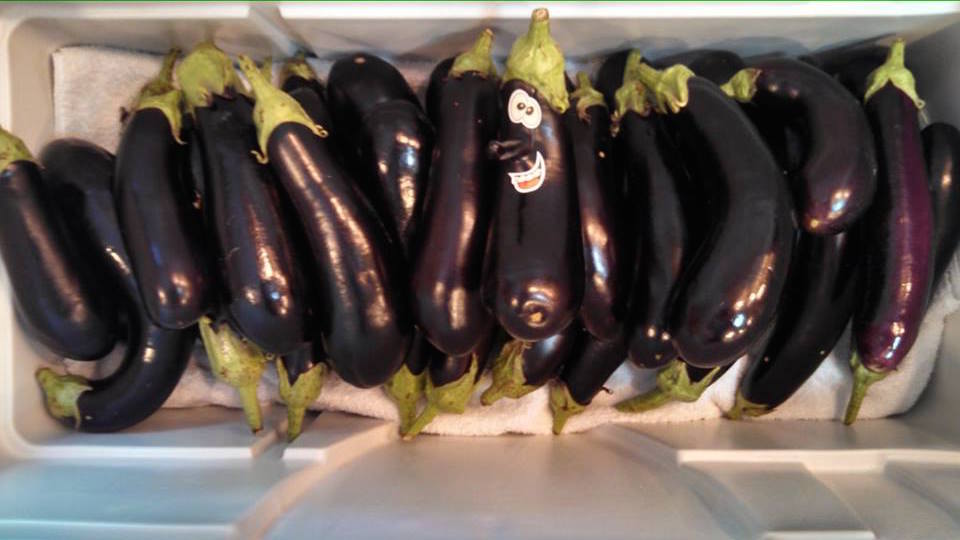
At what (x,y) coordinates should I click in order to perform the action: click on towel. Please return your answer as a coordinate pair (x, y). Looking at the image, I should click on (517, 428).